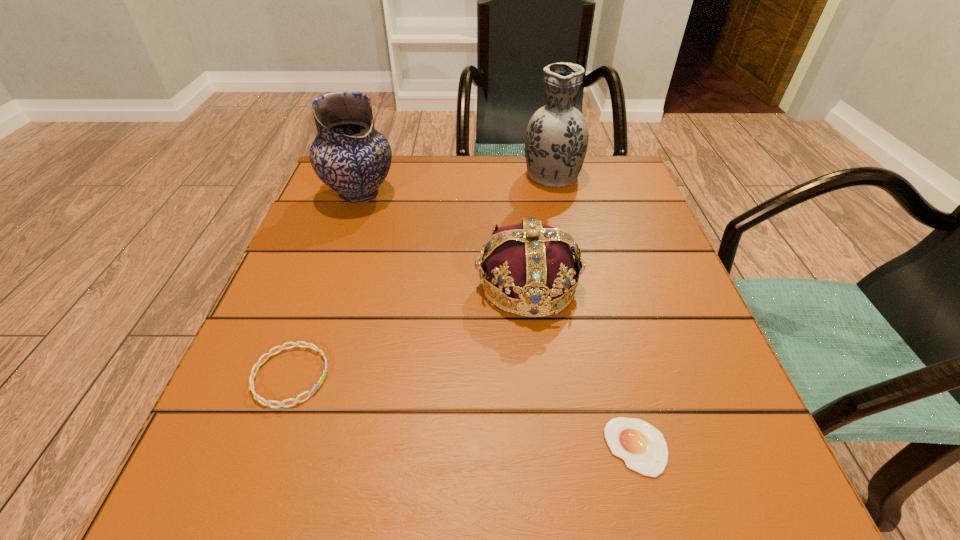
Find the location of a particular element. This screenshot has width=960, height=540. free space that satisfies the following two spatial constraints: 1. on the front side of the pottery; 2. on the right side of the egg yolk is located at coordinates (271, 447).